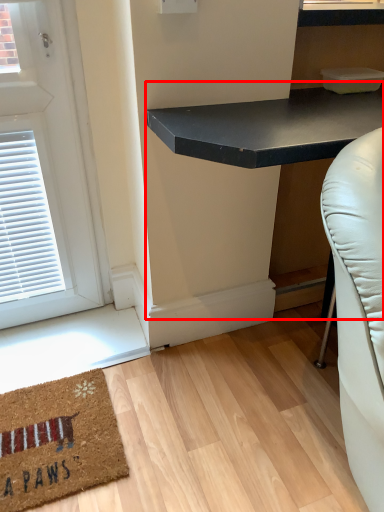
Question: From the image's perspective, where is table (annotated by the red box) located in relation to mat in the image?

Choices:
 (A) above
 (B) below

Answer: (A)